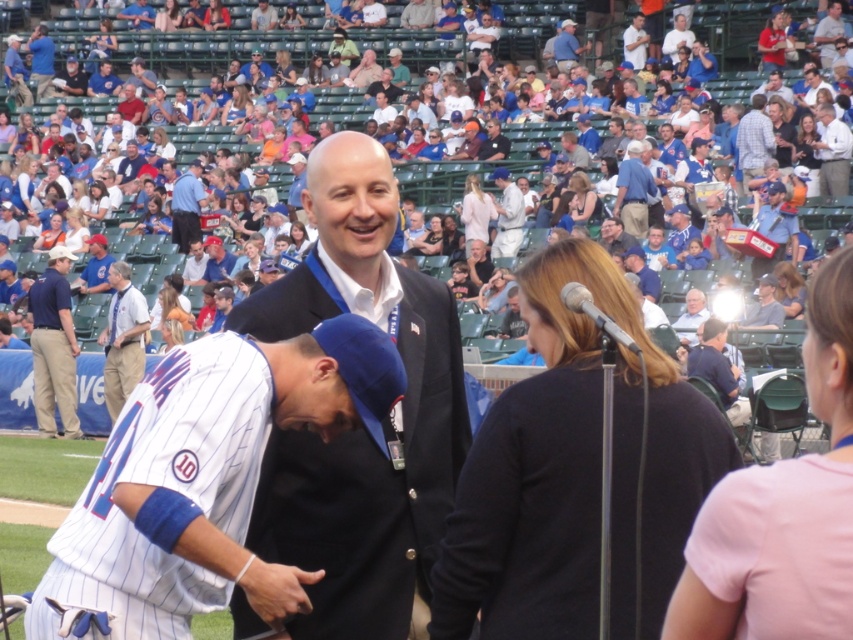
Question: Does dark blue uniform at left lie behind gray fabric jacket at upper right?

Choices:
 (A) no
 (B) yes

Answer: (B)

Question: From the image, what is the correct spatial relationship of dark blue uniform at left in relation to white pinstriped jersey at upper center?

Choices:
 (A) below
 (B) above

Answer: (A)

Question: Which is farther from the white pinstriped jersey at center?

Choices:
 (A) metallic silver microphone at center
 (B) dark blue uniform at left
 (C) blue fabric jacket at upper right

Answer: (C)

Question: Among these objects, which one is nearest to the camera?

Choices:
 (A) light blue shirt at upper right
 (B) white pinstriped jersey at upper center
 (C) white pinstriped jersey at center
 (D) dark blue uniform at left

Answer: (C)

Question: Does dark blue uniform at left have a greater width compared to blue jersey at left?

Choices:
 (A) no
 (B) yes

Answer: (B)

Question: Among these points, which one is nearest to the camera?

Choices:
 (A) tap(61, 289)
 (B) tap(103, 337)
 (C) tap(637, 156)
 (D) tap(247, 372)

Answer: (D)